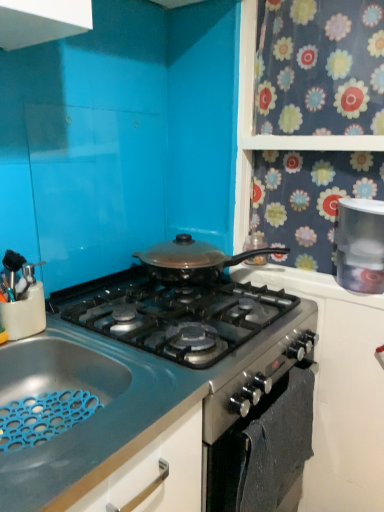
Question: Considering the positions of satin silver oven at lower center and satin black pan at center in the image, is satin silver oven at lower center wider or thinner than satin black pan at center?

Choices:
 (A) wide
 (B) thin

Answer: (B)

Question: From the image's perspective, is satin silver oven at lower center located above or below satin black pan at center?

Choices:
 (A) below
 (B) above

Answer: (A)

Question: Considering the real-world distances, which object is closest to the white plastic container at upper right?

Choices:
 (A) satin black pan at center
 (B) blue rubber mat at lower left
 (C) satin silver oven at lower center

Answer: (C)

Question: Which is nearer to the white plastic container at upper right?

Choices:
 (A) satin silver oven at lower center
 (B) satin black pan at center
 (C) blue rubber mat at lower left

Answer: (A)